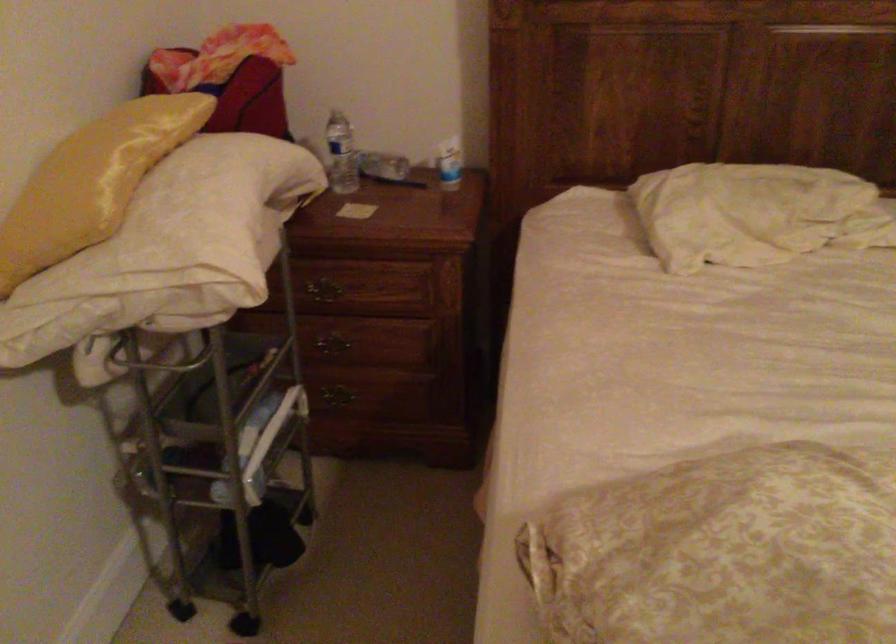
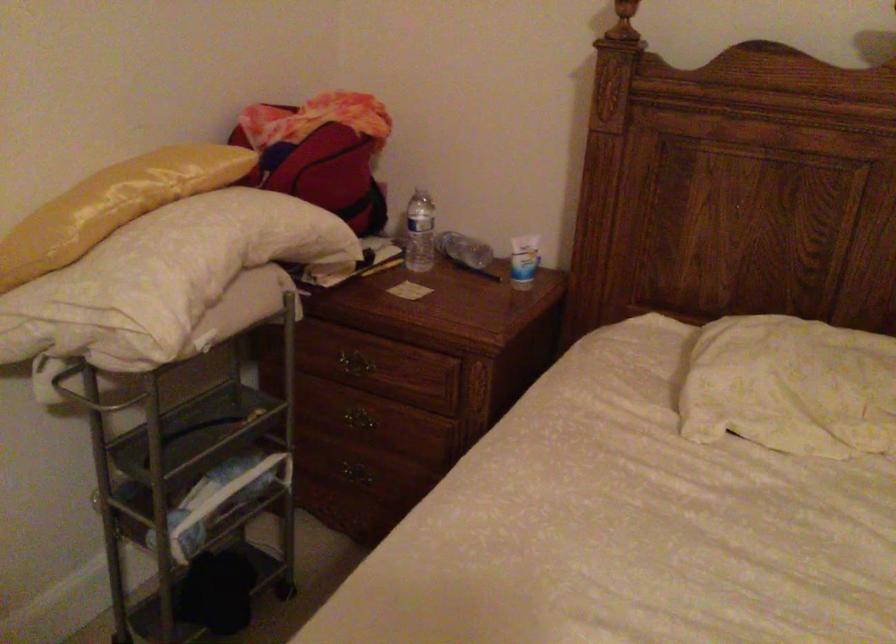
Locate, in the second image, the point that corresponds to pixel 337 395 in the first image.

(355, 473)